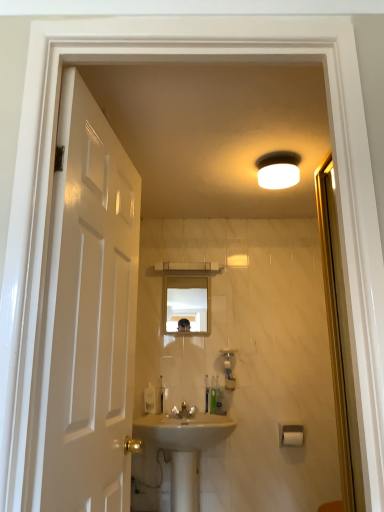
The image size is (384, 512). Describe the element at coordinates (228, 370) in the screenshot. I see `translucent plastic soap dispenser at center` at that location.

What do you see at coordinates (159, 395) in the screenshot? I see `translucent plastic toothbrush at center, which is the 4th toiletry in right-to-left order` at bounding box center [159, 395].

The image size is (384, 512). Describe the element at coordinates (278, 170) in the screenshot. I see `white matte light fixture at upper center` at that location.

I want to click on white plastic toothbrush at center, the 1th toiletry viewed from the left, so click(149, 399).

Locate an element on the screen. Image resolution: width=384 pixels, height=512 pixels. translucent plastic soap dispenser at center is located at coordinates (228, 370).

Is translucent plastic toothbrush at center, which is the second toiletry from left to right, not inside white matte light fixture at upper center?

translucent plastic toothbrush at center, which is the second toiletry from left to right, lies outside white matte light fixture at upper center's area.

Which of these two, translucent plastic toothbrush at center, which is the second toiletry from left to right, or white matte light fixture at upper center, stands shorter?

With less height is white matte light fixture at upper center.

Considering the points (162, 402) and (295, 153), which point is in front, point (162, 402) or point (295, 153)?

The point (295, 153) is in front.

Which object is positioned more to the right, translucent plastic toothbrush at center, which is the second toiletry from left to right, or white matte light fixture at upper center?

From the viewer's perspective, white matte light fixture at upper center appears more on the right side.

Which of these two, clear glass mirror at center or beige ceramic sink at center, is wider?

Wider between the two is beige ceramic sink at center.

Between clear glass mirror at center and beige ceramic sink at center, which one has less height?

clear glass mirror at center.

Identify the location of mirror above the beige ceramic sink at center (from the image's perspective). (186, 304).

How many degrees apart are the facing directions of clear glass mirror at center and beige ceramic sink at center?

They differ by 0.0738 degrees in their facing directions.

Considering the points (162, 401) and (332, 240), which point is behind, point (162, 401) or point (332, 240)?

The point (162, 401) is more distant.

Between translucent plastic toothbrush at center, which is the 4th toiletry in right-to-left order, and transparent glass screen door at right, which one has larger size?

With larger size is transparent glass screen door at right.

Consider the image. How far apart are translucent plastic toothbrush at center, which is the second toiletry from left to right, and transparent glass screen door at right?

translucent plastic toothbrush at center, which is the second toiletry from left to right, is 1.38 meters from transparent glass screen door at right.

Is translucent plastic toothbrush at center, which is the second toiletry from left to right, to the left or to the right of transparent glass screen door at right in the image?

Clearly, translucent plastic toothbrush at center, which is the second toiletry from left to right, is on the left of transparent glass screen door at right in the image.

In the scene shown: Does white plastic toothbrush at center, the fifth toiletry in the right-to-left sequence, appear on the left side of translucent plastic toothbrush at center, the second toiletry positioned from the right?

Yes.

Which is closer to the camera, (155, 412) or (218, 409)?

The point (218, 409) is more forward.

Does white plastic toothbrush at center, the 1th toiletry viewed from the left, lie in front of translucent plastic toothbrush at center, which ranks as the 4th toiletry in left-to-right order?

Yes, it is.

Is white plastic toothbrush at center, the 1th toiletry viewed from the left, spatially inside translucent plastic toothbrush at center, which ranks as the 4th toiletry in left-to-right order, or outside of it?

white plastic toothbrush at center, the 1th toiletry viewed from the left, is not inside translucent plastic toothbrush at center, which ranks as the 4th toiletry in left-to-right order, it's outside.

From a real-world perspective, between white matte light fixture at upper center and white plastic toothbrush at center, the fifth toiletry in the right-to-left sequence, who is vertically lower?

white plastic toothbrush at center, the fifth toiletry in the right-to-left sequence.

Between white matte light fixture at upper center and white plastic toothbrush at center, the fifth toiletry in the right-to-left sequence, which one has less height?

Standing shorter between the two is white matte light fixture at upper center.

Is white matte light fixture at upper center aimed at white plastic toothbrush at center, the fifth toiletry in the right-to-left sequence?

No, white matte light fixture at upper center is not oriented towards white plastic toothbrush at center, the fifth toiletry in the right-to-left sequence.

In the image, there is a clear glass mirror at center. Where is `sink below it (from a real-world perspective)`? Image resolution: width=384 pixels, height=512 pixels. sink below it (from a real-world perspective) is located at coordinates (184, 449).

From the image's perspective, which is above, beige ceramic sink at center or clear glass mirror at center?

From the image's view, clear glass mirror at center is above.

Is beige ceramic sink at center outside of clear glass mirror at center?

Yes, beige ceramic sink at center is located beyond the bounds of clear glass mirror at center.

Does beige ceramic sink at center come in front of clear glass mirror at center?

Yes, it is.

Can you confirm if translucent plastic toothbrush at center, which ranks as the 4th toiletry in left-to-right order, is wider than white matte light fixture at upper center?

In fact, translucent plastic toothbrush at center, which ranks as the 4th toiletry in left-to-right order, might be narrower than white matte light fixture at upper center.

From the image's perspective, who appears lower, translucent plastic toothbrush at center, which ranks as the 4th toiletry in left-to-right order, or white matte light fixture at upper center?

translucent plastic toothbrush at center, which ranks as the 4th toiletry in left-to-right order.

Can you confirm if translucent plastic toothbrush at center, which ranks as the 4th toiletry in left-to-right order, is shorter than white matte light fixture at upper center?

Incorrect, the height of translucent plastic toothbrush at center, which ranks as the 4th toiletry in left-to-right order, does not fall short of that of white matte light fixture at upper center.

Where is `light fixture on the right of translucent plastic toothbrush at center, which is the second toiletry from left to right`? This screenshot has height=512, width=384. light fixture on the right of translucent plastic toothbrush at center, which is the second toiletry from left to right is located at coordinates (278, 170).

Locate an element on the screen. This screenshot has height=512, width=384. sink on the left of clear glass mirror at center is located at coordinates (184, 449).

When comparing their distances from transparent glass screen door at right, does green plastic toothbrush at lower center, marked as the 1th toiletry in a right-to-left arrangement, or white glossy faucet at center seem closer?

green plastic toothbrush at lower center, marked as the 1th toiletry in a right-to-left arrangement.

From the image, which object appears to be nearer to green plastic toothbrush at lower center, marked as the 1th toiletry in a right-to-left arrangement, translucent plastic toothbrush at center, which is the second toiletry from left to right, or white plastic toothbrush at center, the fifth toiletry in the right-to-left sequence?

translucent plastic toothbrush at center, which is the second toiletry from left to right.

Considering their positions, is beige ceramic sink at center positioned closer to white matte light fixture at upper center than transparent glass screen door at right?

transparent glass screen door at right.

Considering their positions, is white plastic toothbrush at center, the 1th toiletry viewed from the left, positioned closer to green plastic toothbrush at lower center, which is the 5th toiletry from left to right, than clear glass mirror at center?

white plastic toothbrush at center, the 1th toiletry viewed from the left.

In the scene shown: Considering their positions, is translucent plastic toothbrush at center, which is the second toiletry from left to right, positioned closer to transparent glass screen door at right than white plastic toothbrush at center, the fifth toiletry in the right-to-left sequence?

translucent plastic toothbrush at center, which is the second toiletry from left to right, is closer to transparent glass screen door at right.

When comparing their distances from white plastic toothbrush at center, the fifth toiletry in the right-to-left sequence, does clear glass mirror at center or beige ceramic sink at center seem further?

clear glass mirror at center is further to white plastic toothbrush at center, the fifth toiletry in the right-to-left sequence.

Which object lies further to the anchor point transparent glass screen door at right, translucent plastic soap dispenser at center, the 3th toiletry in the right-to-left sequence, or green plastic toothbrush at lower center, marked as the 1th toiletry in a right-to-left arrangement?

translucent plastic soap dispenser at center, the 3th toiletry in the right-to-left sequence, is positioned further to the anchor transparent glass screen door at right.

From the image, which object appears to be farther from glossy white door at left, white plastic toothbrush at center, the 1th toiletry viewed from the left, or translucent plastic soap dispenser at center, the 3th toiletry in the right-to-left sequence?

Based on the image, translucent plastic soap dispenser at center, the 3th toiletry in the right-to-left sequence, appears to be further to glossy white door at left.

This screenshot has width=384, height=512. In order to click on tap between beige ceramic sink at center and translucent plastic toothbrush at center, which is the second toiletry from left to right, along the z-axis in this screenshot , I will do `click(184, 411)`.

I want to click on soap dispenser between white matte light fixture at upper center and translucent plastic toothbrush at center, which is the second toiletry from left to right, in the vertical direction, so click(228, 370).

The width and height of the screenshot is (384, 512). In order to click on soap dispenser between beige ceramic sink at center and translucent plastic toothbrush at center, which is the second toiletry from left to right, along the z-axis in this screenshot , I will do `click(228, 370)`.

Identify the location of soap dispenser between glossy white door at left and white plastic toothbrush at center, the 1th toiletry viewed from the left, in the front-back direction. (228, 370).